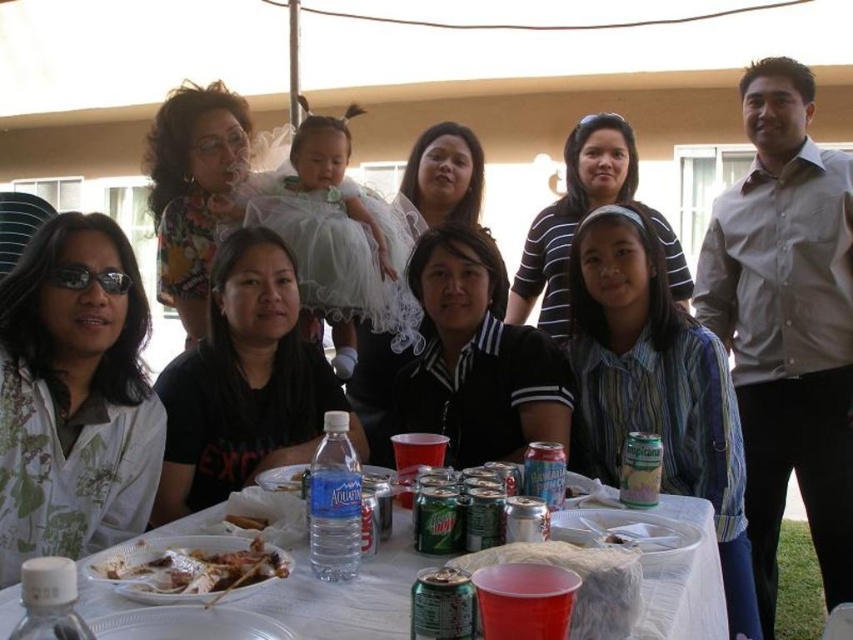
Can you confirm if grilled meat skewers at table center is positioned above white crumbly bread at table center?

Incorrect, grilled meat skewers at table center is not positioned above white crumbly bread at table center.

Where is `grilled meat skewers at table center`? The height and width of the screenshot is (640, 853). grilled meat skewers at table center is located at coordinates (189, 566).

You are a GUI agent. You are given a task and a screenshot of the screen. Output one action in this format:
    pyautogui.click(x=<x>, y=<y>)
    Task: Click on the grilled meat skewers at table center
    Image resolution: width=853 pixels, height=640 pixels.
    Given the screenshot: What is the action you would take?
    coord(189,566)

Which is in front, point (294, 573) or point (259, 529)?

Point (294, 573)

You are a GUI agent. You are given a task and a screenshot of the screen. Output one action in this format:
    pyautogui.click(x=<x>, y=<y>)
    Task: Click on the white plastic table at center
    
    Given the screenshot: What is the action you would take?
    pyautogui.click(x=347, y=593)

Is the position of white plastic table at center less distant than that of grilled meat skewers at table center?

Yes, it is in front of grilled meat skewers at table center.

Who is higher up, white plastic table at center or grilled meat skewers at table center?

Positioned higher is grilled meat skewers at table center.

Find the location of a particular element. This screenshot has height=640, width=853. white plastic table at center is located at coordinates (347, 593).

Where is `white plastic table at center`? Image resolution: width=853 pixels, height=640 pixels. white plastic table at center is located at coordinates (347, 593).